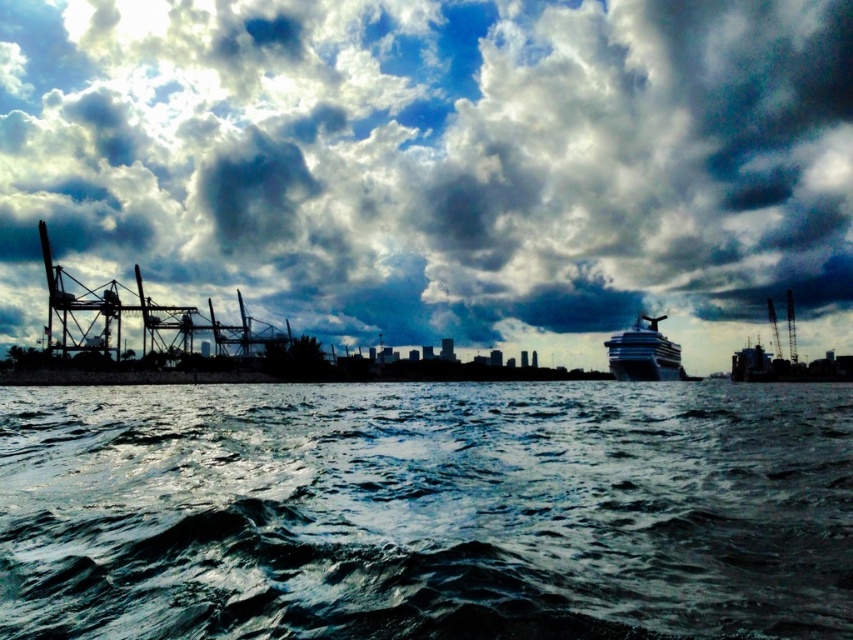
Based on the scene description and the coordinates provided, what is located at the point marked as point (426, 512)?

The point (426, 512) is occupied by dark blue water at lower center.

You are standing at the harbor and looking at two points in the scene. The first point is at coordinates point (442, 310) and the second is at point (518, 420). Which point is closer to you?

Point (442, 310) is further to the camera than point (518, 420), so the second point is closer to you.

You are an observer standing at the harbor and see the dark blue water at lower center and the white glossy cruise ship at right. Which object occupies more horizontal space in the image?

The dark blue water at lower center occupies more horizontal space than the white glossy cruise ship at right because its width is larger.